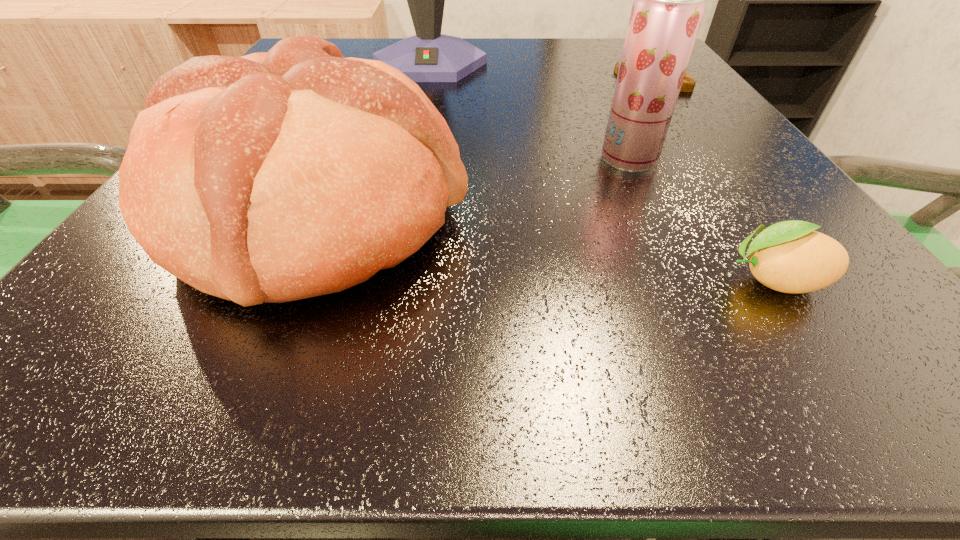
Locate an element on the screen. This screenshot has width=960, height=540. free spot between the tallest object and the figurine is located at coordinates (543, 71).

Identify the location of free space between the bread and the figurine. The image size is (960, 540). (488, 147).

Where is `free space that is in between the bread and the lemon`? The height and width of the screenshot is (540, 960). free space that is in between the bread and the lemon is located at coordinates (546, 247).

Find the location of a particular element. free space between the lemon and the figurine is located at coordinates (715, 180).

Where is `free spot between the lampshade and the figurine`? free spot between the lampshade and the figurine is located at coordinates (543, 71).

You are a GUI agent. You are given a task and a screenshot of the screen. Output one action in this format:
    pyautogui.click(x=<x>, y=<y>)
    Task: Click on the third closest object to the figurine
    The height and width of the screenshot is (540, 960).
    Given the screenshot: What is the action you would take?
    pos(276,176)

Where is `object that stands as the second closest to the tallest object`? Image resolution: width=960 pixels, height=540 pixels. object that stands as the second closest to the tallest object is located at coordinates (669, 0).